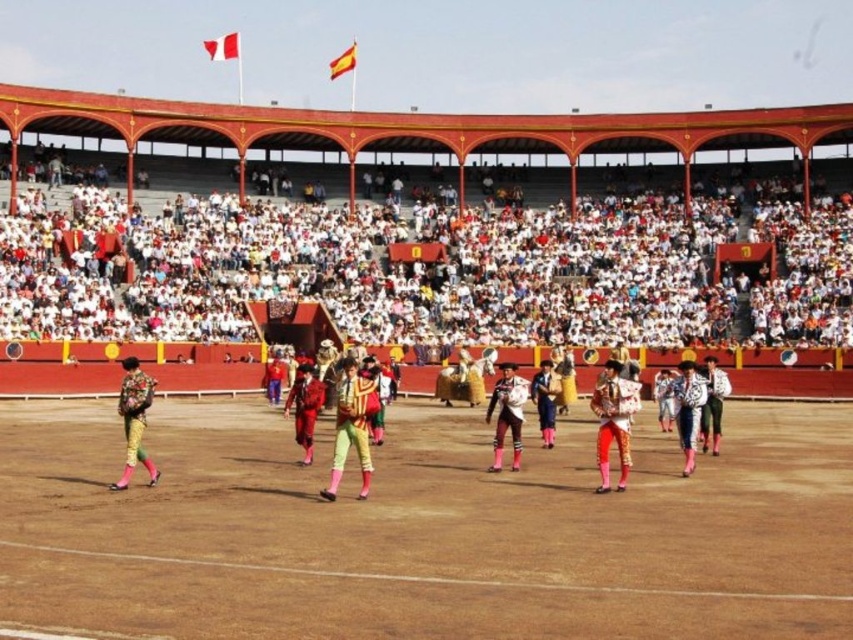
Is white fabric crowd at upper center closer to camera compared to yellow-green fabric pants at center?

No, white fabric crowd at upper center is behind yellow-green fabric pants at center.

Between point (786, 252) and point (335, 481), which one is positioned in front?

Point (335, 481) is in front.

You are a GUI agent. You are given a task and a screenshot of the screen. Output one action in this format:
    pyautogui.click(x=<x>, y=<y>)
    Task: Click on the white fabric crowd at upper center
    
    Given the screenshot: What is the action you would take?
    pyautogui.click(x=434, y=269)

Between point (601, 381) and point (300, 388), which one is positioned behind?

The point (300, 388) is behind.

Is shiny gold jacket at center to the left of shiny red pants at center from the viewer's perspective?

Incorrect, shiny gold jacket at center is not on the left side of shiny red pants at center.

Image resolution: width=853 pixels, height=640 pixels. What do you see at coordinates (613, 420) in the screenshot? I see `shiny gold jacket at center` at bounding box center [613, 420].

Identify the location of shiny gold jacket at center. This screenshot has height=640, width=853. (613, 420).

Consider the image. Who is more distant from viewer, [128,404] or [305,435]?

The point [305,435] is more distant.

Between floral fabric jacket at left and shiny red pants at center, which one appears on the right side from the viewer's perspective?

shiny red pants at center

What do you see at coordinates (134, 419) in the screenshot? I see `floral fabric jacket at left` at bounding box center [134, 419].

You are a GUI agent. You are given a task and a screenshot of the screen. Output one action in this format:
    pyautogui.click(x=<x>, y=<y>)
    Task: Click on the floral fabric jacket at left
    This screenshot has width=853, height=640.
    Given the screenshot: What is the action you would take?
    pyautogui.click(x=134, y=419)